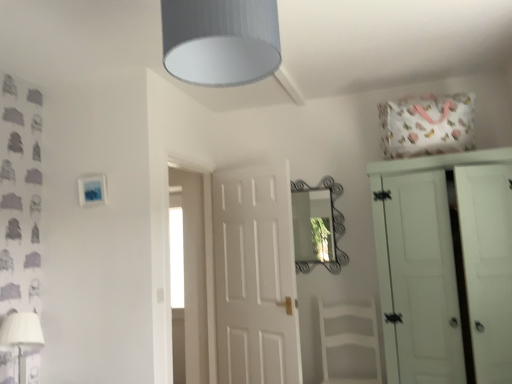
At what (x,y) coordinates should I click in order to perform the action: click on white wood armchair at center. Please return your answer as a coordinate pair (x, y). Looking at the image, I should click on (349, 344).

In order to face white fabric lampshade at lower left, should I rotate leftwards or rightwards?

To align with it, rotate left about 27.645°.

Identify the location of white wood armchair at center. The image size is (512, 384). (349, 344).

Can you confirm if white painted wood wardrobe at right is taller than gray textured lampshade at upper center?

Correct, white painted wood wardrobe at right is much taller as gray textured lampshade at upper center.

Can you confirm if white painted wood wardrobe at right is wider than gray textured lampshade at upper center?

Yes, white painted wood wardrobe at right is wider than gray textured lampshade at upper center.

How different are the orientations of white painted wood wardrobe at right and gray textured lampshade at upper center in degrees?

The angular difference between white painted wood wardrobe at right and gray textured lampshade at upper center is 178 degrees.

Is white painted wood wardrobe at right far away from gray textured lampshade at upper center?

That's right, there is a large distance between white painted wood wardrobe at right and gray textured lampshade at upper center.

Could you tell me if white painted wood wardrobe at right is turned towards white matte door at center?

No, white painted wood wardrobe at right is not aimed at white matte door at center.

From a real-world perspective, which is physically above, white painted wood wardrobe at right or white matte door at center?

From a 3D spatial view, white matte door at center is above.

Which is behind, point (31, 336) or point (245, 44)?

The point (31, 336) is farther.

Consider the image. Is white fabric lampshade at lower left touching gray textured lampshade at upper center?

No, white fabric lampshade at lower left is not next to gray textured lampshade at upper center.

From the image's perspective, which one is positioned lower, white fabric lampshade at lower left or gray textured lampshade at upper center?

white fabric lampshade at lower left is shown below in the image.

Which is more to the right, white fabric lampshade at lower left or gray textured lampshade at upper center?

From the viewer's perspective, gray textured lampshade at upper center appears more on the right side.

There is a white fabric lampshade at lower left. Where is `door above it (from a real-world perspective)`? door above it (from a real-world perspective) is located at coordinates 255,276.

Between white matte door at center and white fabric lampshade at lower left, which one has smaller size?

white fabric lampshade at lower left is smaller.

Does white matte door at center appear on the right side of white fabric lampshade at lower left?

Indeed, white matte door at center is positioned on the right side of white fabric lampshade at lower left.

From the image's perspective, is gray textured lampshade at upper center located above white matte door at center?

Indeed, from the image's perspective, gray textured lampshade at upper center is shown above white matte door at center.

Which is in front, point (193, 16) or point (234, 207)?

Point (193, 16)

You are a GUI agent. You are given a task and a screenshot of the screen. Output one action in this format:
    pyautogui.click(x=<x>, y=<y>)
    Task: Click on the door that appears on the right of gray textured lampshade at upper center
    
    Given the screenshot: What is the action you would take?
    pyautogui.click(x=255, y=276)

Is gray textured lampshade at upper center situated inside white matte door at center or outside?

gray textured lampshade at upper center cannot be found inside white matte door at center.

Considering their positions, is white fabric lampshade at lower left located in front of or behind white wood armchair at center?

Clearly, white fabric lampshade at lower left is in front of white wood armchair at center.

Is white fabric lampshade at lower left completely or partially outside of white wood armchair at center?

Yes, white fabric lampshade at lower left is not within white wood armchair at center.

From the picture: Considering the relative sizes of white fabric lampshade at lower left and white wood armchair at center in the image provided, is white fabric lampshade at lower left wider than white wood armchair at center?

In fact, white fabric lampshade at lower left might be narrower than white wood armchair at center.

Is white fabric lampshade at lower left facing towards white wood armchair at center?

No, white fabric lampshade at lower left does not turn towards white wood armchair at center.

Looking at this image, is white painted wood wardrobe at right a part of white wood armchair at center?

Actually, white painted wood wardrobe at right is outside white wood armchair at center.

Based on the photo, can you see white wood armchair at center touching white painted wood wardrobe at right?

white wood armchair at center and white painted wood wardrobe at right are not in contact.

Does white wood armchair at center have a smaller size compared to white painted wood wardrobe at right?

Correct, white wood armchair at center occupies less space than white painted wood wardrobe at right.

Does white wood armchair at center have a greater height compared to white painted wood wardrobe at right?

No, white wood armchair at center is not taller than white painted wood wardrobe at right.

Locate an element on the screen. This screenshot has width=512, height=384. cupboard below the gray textured lampshade at upper center (from a real-world perspective) is located at coordinates (444, 265).

At what (x,y) coordinates should I click in order to perform the action: click on door located behind the white painted wood wardrobe at right. Please return your answer as a coordinate pair (x, y). The image size is (512, 384). Looking at the image, I should click on (255, 276).

From the image, which object appears to be farther from white matte door at center, white painted wood wardrobe at right or white wood armchair at center?

white painted wood wardrobe at right is positioned further to the anchor white matte door at center.

When comparing their distances from white painted wood wardrobe at right, does white wood armchair at center or gray textured lampshade at upper center seem further?

The object further to white painted wood wardrobe at right is gray textured lampshade at upper center.

From the image, which object appears to be farther from white fabric lampshade at lower left, white matte door at center or white wood armchair at center?

white wood armchair at center lies further to white fabric lampshade at lower left than the other object.

Estimate the real-world distances between objects in this image. Which object is further from white painted wood wardrobe at right, gray textured lampshade at upper center or white matte door at center?

Based on the image, gray textured lampshade at upper center appears to be further to white painted wood wardrobe at right.

Considering their positions, is white painted wood wardrobe at right positioned further to white matte door at center than gray textured lampshade at upper center?

Based on the image, gray textured lampshade at upper center appears to be further to white matte door at center.

From the image, which object appears to be farther from white fabric lampshade at lower left, gray textured lampshade at upper center or white wood armchair at center?

The object further to white fabric lampshade at lower left is white wood armchair at center.

Looking at the image, which one is located further to white painted wood wardrobe at right, white wood armchair at center or white matte door at center?

The object further to white painted wood wardrobe at right is white matte door at center.

When comparing their distances from gray textured lampshade at upper center, does white wood armchair at center or white fabric lampshade at lower left seem further?

The object further to gray textured lampshade at upper center is white wood armchair at center.

Where is `door located between white fabric lampshade at lower left and white wood armchair at center in the left-right direction`? door located between white fabric lampshade at lower left and white wood armchair at center in the left-right direction is located at coordinates (255, 276).

Image resolution: width=512 pixels, height=384 pixels. What are the coordinates of `armchair between white matte door at center and white painted wood wardrobe at right in the horizontal direction` in the screenshot? It's located at (349, 344).

Where is `door between gray textured lampshade at upper center and white fabric lampshade at lower left from top to bottom`? The height and width of the screenshot is (384, 512). door between gray textured lampshade at upper center and white fabric lampshade at lower left from top to bottom is located at coordinates (255, 276).

The image size is (512, 384). I want to click on light fixture between white fabric lampshade at lower left and white painted wood wardrobe at right in the horizontal direction, so click(x=220, y=40).